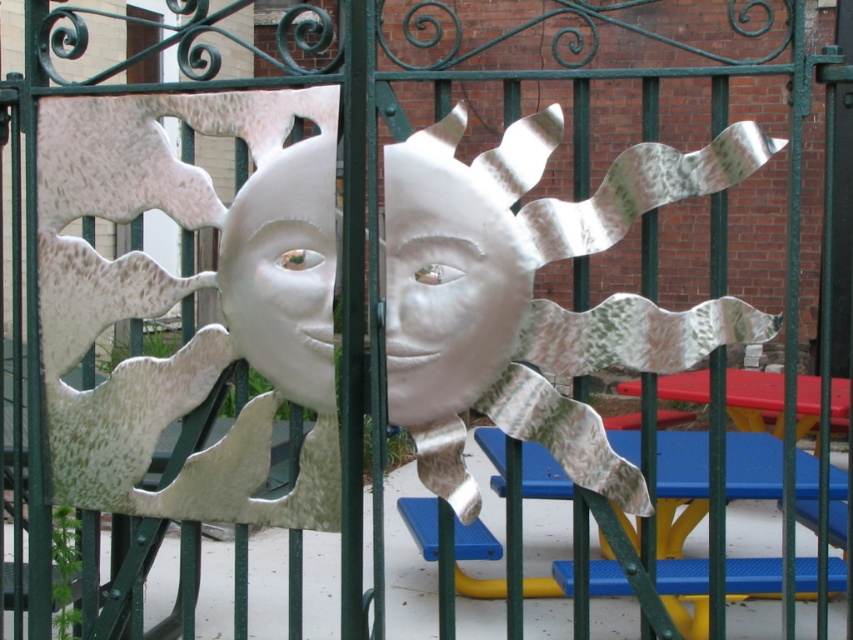
Who is taller, white metallic sun at center or metallic green door at center?

With more height is metallic green door at center.

Looking at this image, does white metallic sun at center have a greater width compared to metallic green door at center?

Indeed, white metallic sun at center has a greater width compared to metallic green door at center.

Is point (80, 333) positioned behind point (845, 179)?

No, it is in front of (845, 179).

Image resolution: width=853 pixels, height=640 pixels. What are the coordinates of `white metallic sun at center` in the screenshot? It's located at (184, 294).

Does white metallic sun at center appear on the right side of metallic silver sun at center?

No, white metallic sun at center is not to the right of metallic silver sun at center.

Who is more distant from viewer, (286, 522) or (454, 164)?

Point (286, 522)

Is point (122, 449) in front of point (476, 179)?

No.

Find the location of a particular element. white metallic sun at center is located at coordinates (184, 294).

Does point (590, 432) come in front of point (846, 289)?

Yes.

In the scene shown: Is metallic silver sun at center taller than metallic green door at center?

Incorrect, metallic silver sun at center's height is not larger of metallic green door at center's.

In order to click on metallic silver sun at center in this screenshot , I will do `click(531, 294)`.

At what (x,y) coordinates should I click in order to perform the action: click on metallic silver sun at center. Please return your answer as a coordinate pair (x, y). Image resolution: width=853 pixels, height=640 pixels. Looking at the image, I should click on (531, 294).